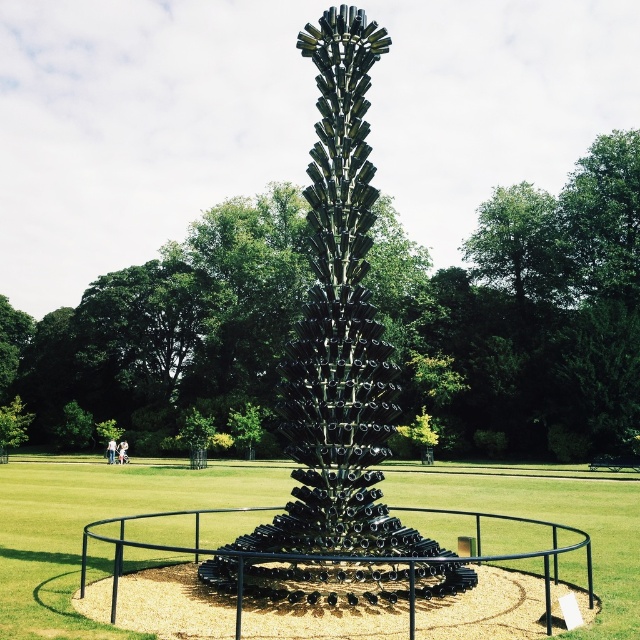
You are a gardener planning to place a new flower bed around the sculpture. You have two options for placement based on the space occupied by the metallic sculpture at center and the black glass sculpture at center. Which sculpture requires more horizontal space for the flower bed?

The metallic sculpture at center might be wider than black glass sculpture at center, so it requires more horizontal space for the flower bed.

You are standing in the park and see the metallic sculpture at center and the black glass sculpture at center. Which one is positioned higher up?

The metallic sculpture at center is located above the black glass sculpture at center, so it is positioned higher up.